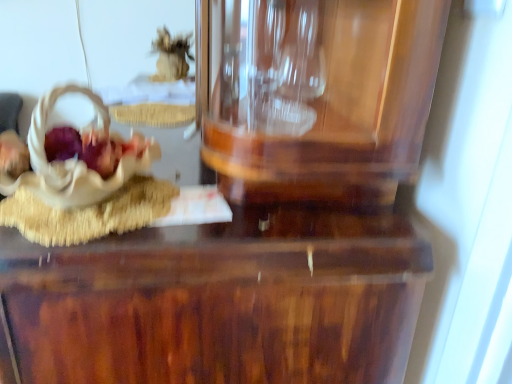
Question: From the image's perspective, does beige fabric basket at left, the 1th stuff when ordered from bottom to top, appear lower than matte brown basket at left?

Choices:
 (A) no
 (B) yes

Answer: (A)

Question: From a real-world perspective, is beige fabric basket at left, the 1th stuff when ordered from bottom to top, beneath matte brown basket at left?

Choices:
 (A) no
 (B) yes

Answer: (A)

Question: Does beige fabric basket at left, marked as the second stuff in a back-to-front arrangement, contain matte brown basket at left?

Choices:
 (A) no
 (B) yes

Answer: (A)

Question: Is beige fabric basket at left, the second stuff positioned from the top, turned away from matte brown basket at left?

Choices:
 (A) no
 (B) yes

Answer: (A)

Question: Does beige fabric basket at left, the 1th stuff positioned from the front, have a larger size compared to matte brown basket at left?

Choices:
 (A) no
 (B) yes

Answer: (B)

Question: Can you confirm if beige fabric basket at left, marked as the second stuff in a back-to-front arrangement, is wider than matte brown basket at left?

Choices:
 (A) no
 (B) yes

Answer: (B)

Question: Is matte brown basket at left turned away from glossy wood table at center?

Choices:
 (A) yes
 (B) no

Answer: (B)

Question: Does matte brown basket at left lie in front of glossy wood table at center?

Choices:
 (A) yes
 (B) no

Answer: (B)

Question: Considering the relative sizes of matte brown basket at left and glossy wood table at center in the image provided, is matte brown basket at left wider than glossy wood table at center?

Choices:
 (A) no
 (B) yes

Answer: (A)

Question: From the image's perspective, is matte brown basket at left on glossy wood table at center?

Choices:
 (A) yes
 (B) no

Answer: (A)

Question: Considering the relative sizes of matte brown basket at left and glossy wood table at center in the image provided, is matte brown basket at left taller than glossy wood table at center?

Choices:
 (A) yes
 (B) no

Answer: (B)

Question: From a real-world perspective, is matte brown basket at left positioned over glossy wood table at center based on gravity?

Choices:
 (A) yes
 (B) no

Answer: (A)

Question: Considering the relative positions of matte brown basket at left and beige fabric basket at left, the 1th stuff positioned from the front, in the image provided, is matte brown basket at left to the right of beige fabric basket at left, the 1th stuff positioned from the front, from the viewer's perspective?

Choices:
 (A) yes
 (B) no

Answer: (A)